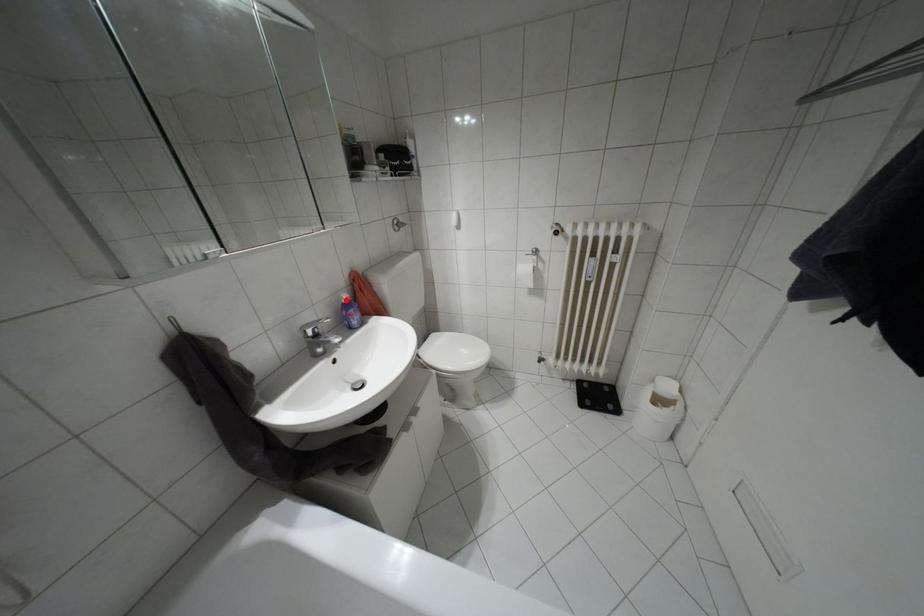
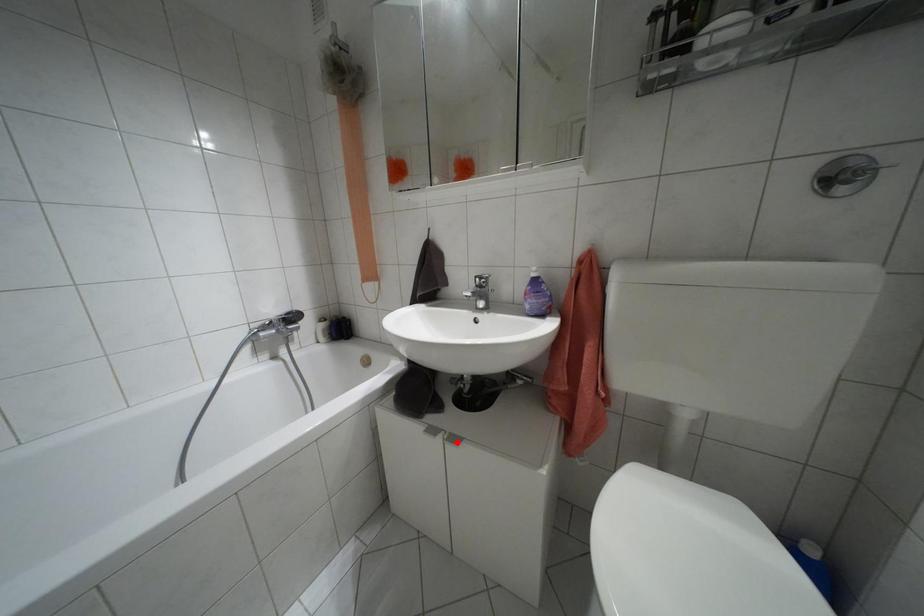
I am providing you with two images of the same scene from different viewpoints. A red point is marked on the first image and another point is marked on the second image. Do the highlighted points in image1 and image2 indicate the same real-world spot?

No